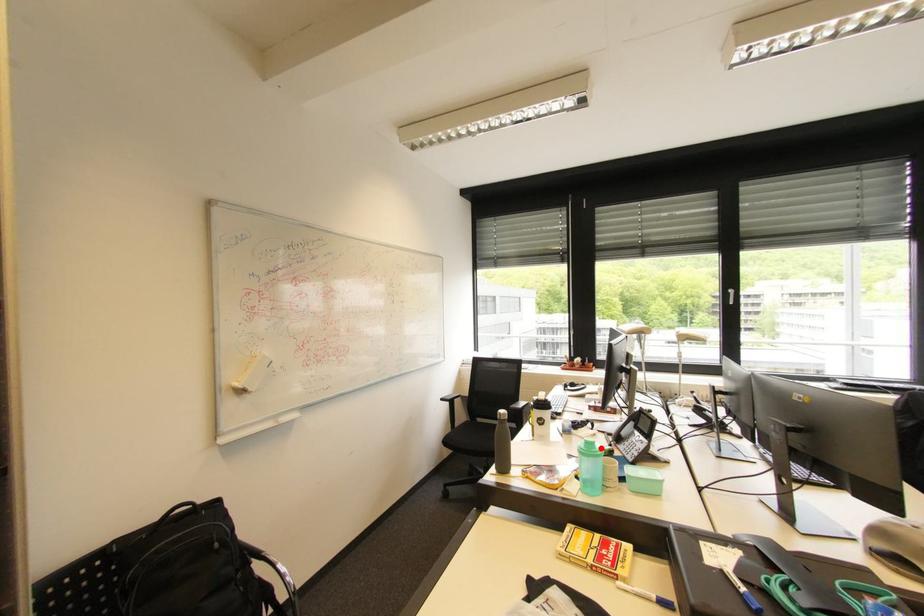
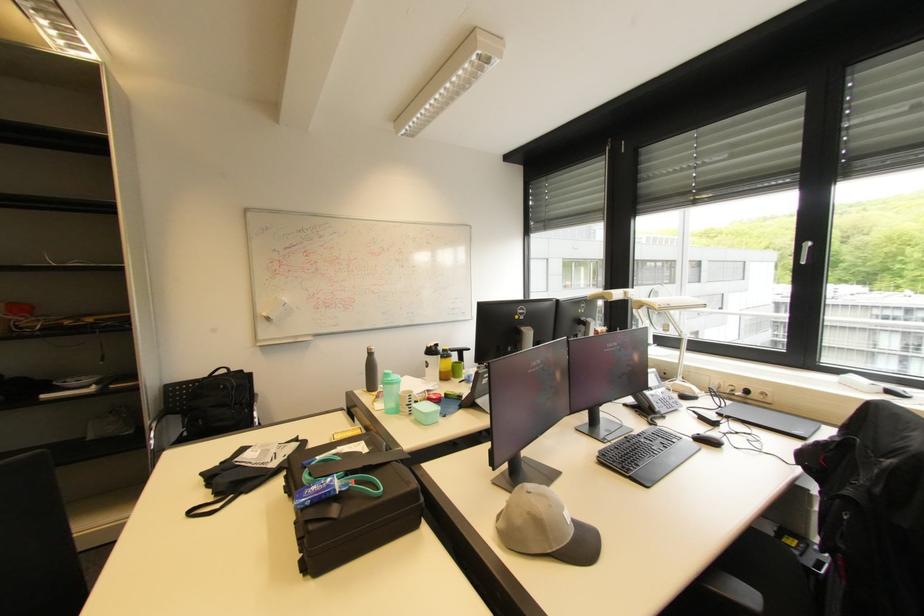
Question: I am providing you with two images of the same scene from different viewpoints. A red point is shown in image1. For the corresponding object point in image2, is it positioned nearer or farther from the camera?

Choices:
 (A) Nearer
 (B) Farther

Answer: (B)